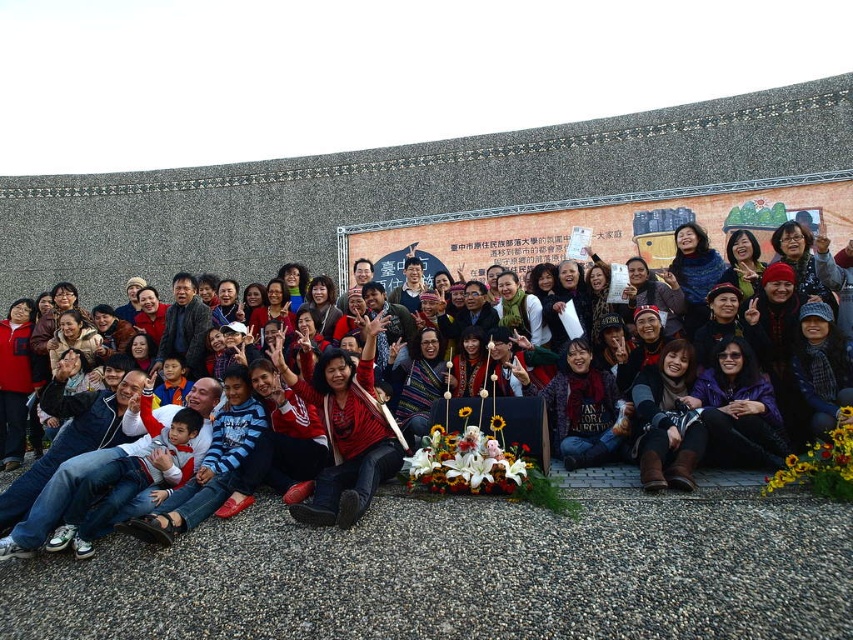
You are a photographer at the event and want to take a photo of both the white silk flowers at center and the red sweater at center. However, you notice that one object is blocking the view of the other. Which object is blocking the other?

The red sweater at center is behind the white silk flowers at center, so the white silk flowers at center are blocking the view of the red sweater at center.